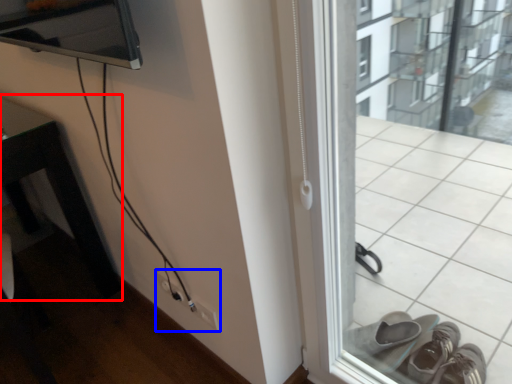
Question: Which of the following is the farthest to the observer, table (highlighted by a red box) or electric outlet (highlighted by a blue box)?

Choices:
 (A) table
 (B) electric outlet

Answer: (B)